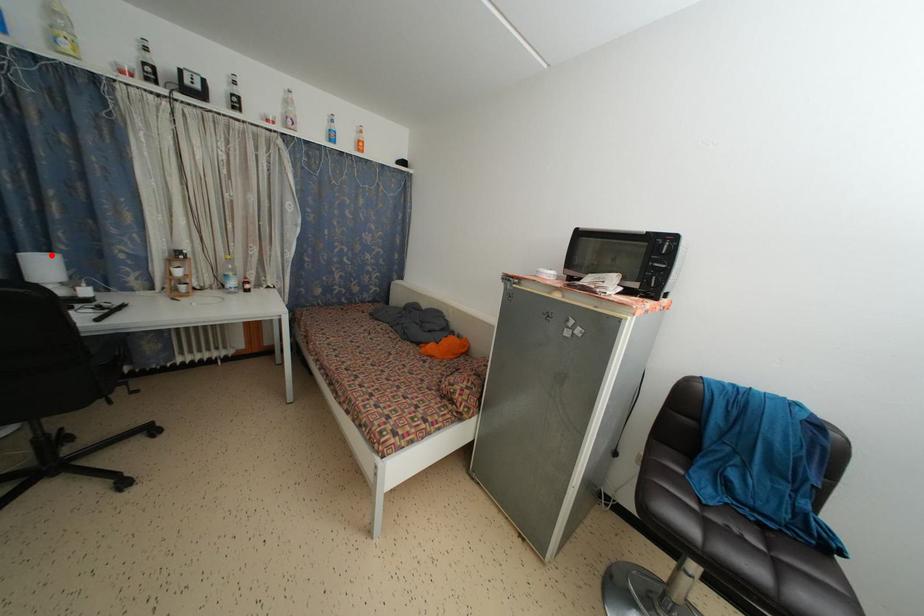
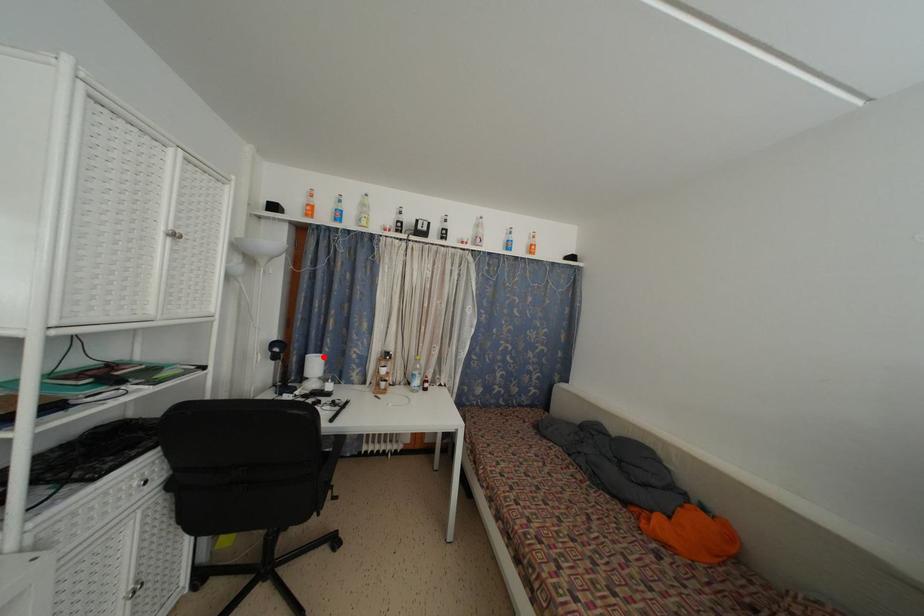
I am providing you with two images of the same scene from different viewpoints. A red point is marked on the first image and another point is marked on the second image. Are the points marked in image1 and image2 representing the same 3D position?

Yes